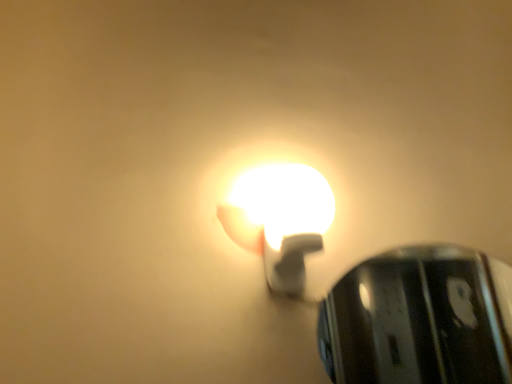
Question: Should I look upward or downward to see white glossy bulb at center, which is counted as the 2th lamp, starting from the right?

Choices:
 (A) up
 (B) down

Answer: (B)

Question: Which direction should I rotate to face glossy metallic lamp at upper center, acting as the 1th lamp starting from the right, — up or down?

Choices:
 (A) up
 (B) down

Answer: (B)

Question: Could you tell me if white glossy bulb at center, which is counted as the 2th lamp, starting from the right, is facing glossy metallic lamp at upper center, placed as the 2th lamp when sorted from left to right?

Choices:
 (A) no
 (B) yes

Answer: (A)

Question: Is glossy metallic lamp at upper center, placed as the 2th lamp when sorted from left to right, at the back of white glossy bulb at center, arranged as the 1th lamp when viewed from the left?

Choices:
 (A) no
 (B) yes

Answer: (A)

Question: Is white glossy bulb at center, arranged as the 1th lamp when viewed from the left, not near glossy metallic lamp at upper center, placed as the 2th lamp when sorted from left to right?

Choices:
 (A) yes
 (B) no

Answer: (A)

Question: Is white glossy bulb at center, arranged as the 1th lamp when viewed from the left, not within glossy metallic lamp at upper center, placed as the 2th lamp when sorted from left to right?

Choices:
 (A) yes
 (B) no

Answer: (A)

Question: From a real-world perspective, is white glossy bulb at center, arranged as the 1th lamp when viewed from the left, positioned over glossy metallic lamp at upper center, acting as the 1th lamp starting from the right, based on gravity?

Choices:
 (A) yes
 (B) no

Answer: (A)

Question: Considering the relative positions of white glossy bulb at center, arranged as the 1th lamp when viewed from the left, and glossy metallic lamp at upper center, acting as the 1th lamp starting from the right, in the image provided, is white glossy bulb at center, arranged as the 1th lamp when viewed from the left, to the left of glossy metallic lamp at upper center, acting as the 1th lamp starting from the right, from the viewer's perspective?

Choices:
 (A) yes
 (B) no

Answer: (A)

Question: Does glossy metallic lamp at upper center, acting as the 1th lamp starting from the right, have a greater height compared to white glossy bulb at center, which is counted as the 2th lamp, starting from the right?

Choices:
 (A) no
 (B) yes

Answer: (B)

Question: Can you confirm if glossy metallic lamp at upper center, placed as the 2th lamp when sorted from left to right, is shorter than white glossy bulb at center, which is counted as the 2th lamp, starting from the right?

Choices:
 (A) yes
 (B) no

Answer: (B)

Question: Is glossy metallic lamp at upper center, acting as the 1th lamp starting from the right, not close to white glossy bulb at center, which is counted as the 2th lamp, starting from the right?

Choices:
 (A) no
 (B) yes

Answer: (B)

Question: From the image's perspective, does glossy metallic lamp at upper center, acting as the 1th lamp starting from the right, appear lower than white glossy bulb at center, arranged as the 1th lamp when viewed from the left?

Choices:
 (A) no
 (B) yes

Answer: (B)

Question: From a real-world perspective, is glossy metallic lamp at upper center, acting as the 1th lamp starting from the right, physically below white glossy bulb at center, arranged as the 1th lamp when viewed from the left?

Choices:
 (A) yes
 (B) no

Answer: (A)

Question: Is glossy metallic lamp at upper center, acting as the 1th lamp starting from the right, facing towards white glossy bulb at center, which is counted as the 2th lamp, starting from the right?

Choices:
 (A) no
 (B) yes

Answer: (A)

Question: Considering the positions of white glossy bulb at center, arranged as the 1th lamp when viewed from the left, and glossy metallic lamp at upper center, acting as the 1th lamp starting from the right, in the image, is white glossy bulb at center, arranged as the 1th lamp when viewed from the left, wider or thinner than glossy metallic lamp at upper center, acting as the 1th lamp starting from the right,?

Choices:
 (A) wide
 (B) thin

Answer: (A)